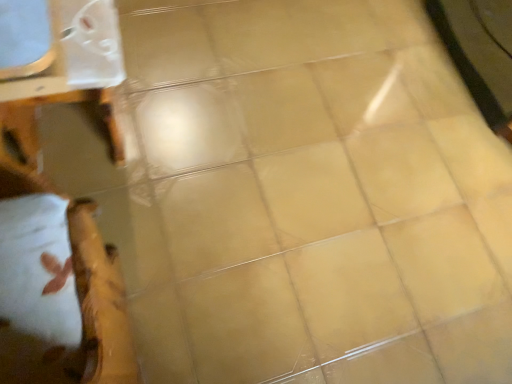
At what (x,y) coordinates should I click in order to perform the action: click on free point behind wooden table at left. Please return your answer as a coordinate pair (x, y). Image resolution: width=512 pixels, height=384 pixels. Looking at the image, I should click on (159, 70).